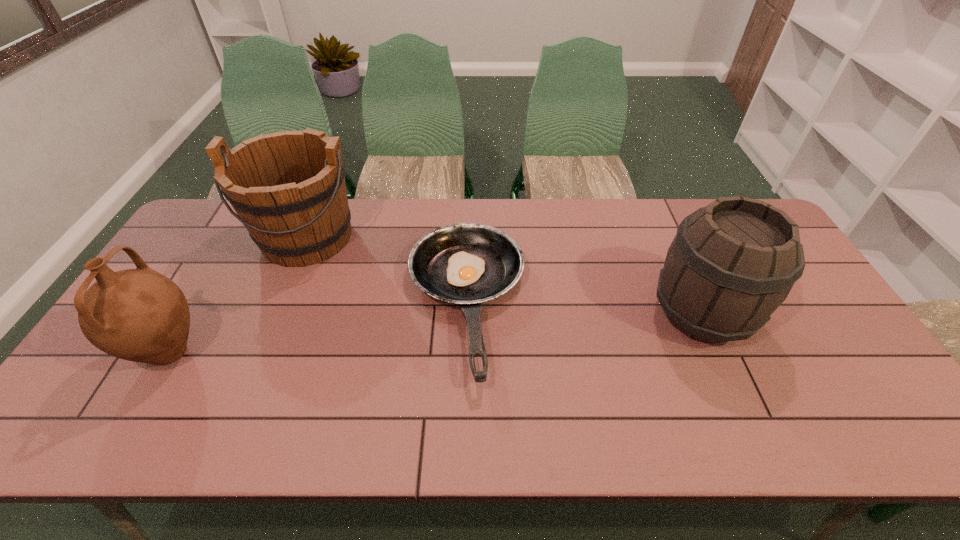
I want to click on wine bucket positioned at the far edge, so click(288, 188).

Identify the location of frying pan at the far edge. This screenshot has height=540, width=960. (464, 263).

The image size is (960, 540). In order to click on object that is at the left edge in this screenshot , I will do `click(139, 315)`.

In the image, there is a desktop. Where is `vacant space at the far edge`? Image resolution: width=960 pixels, height=540 pixels. vacant space at the far edge is located at coordinates (537, 223).

Locate an element on the screen. The height and width of the screenshot is (540, 960). blank area at the near edge is located at coordinates (561, 427).

Find the location of a particular element. free space at the left edge of the desktop is located at coordinates (83, 406).

You are a GUI agent. You are given a task and a screenshot of the screen. Output one action in this format:
    pyautogui.click(x=<x>, y=<y>)
    Task: Click on the vacant space in between the right wine bucket and the pitcher
    The width and height of the screenshot is (960, 540).
    Given the screenshot: What is the action you would take?
    pyautogui.click(x=436, y=333)

Identify the location of vacant space in between the rightmost object and the frying pan. This screenshot has width=960, height=540. (584, 308).

I want to click on vacant space that's between the shortest object and the left wine bucket, so click(387, 270).

Identify the location of vacant region between the pitcher and the left wine bucket. (239, 295).